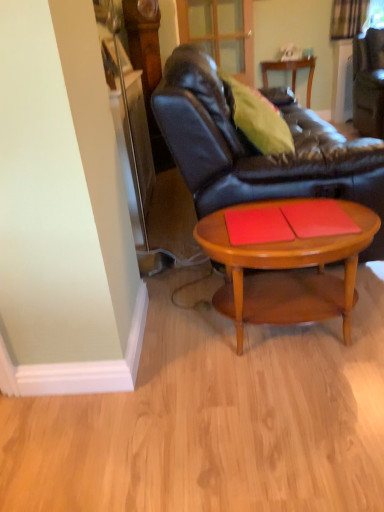
Where is `vacant space to the right of red matte placemat at center, the second plank viewed from the left`? The width and height of the screenshot is (384, 512). vacant space to the right of red matte placemat at center, the second plank viewed from the left is located at coordinates (355, 215).